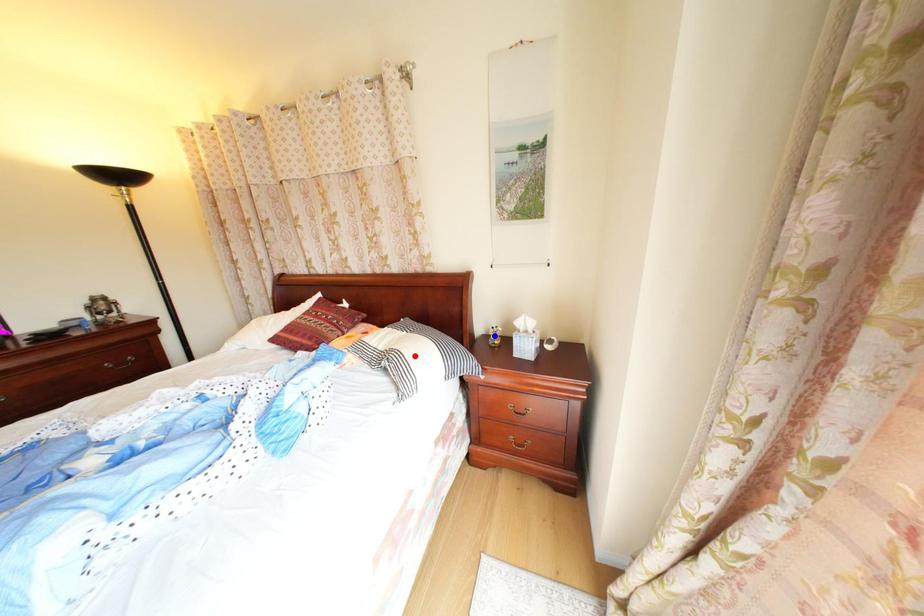
Question: In the image, two points are highlighted. Which point is nearer to the camera? Reply with the corresponding letter.

Choices:
 (A) blue point
 (B) red point

Answer: (B)